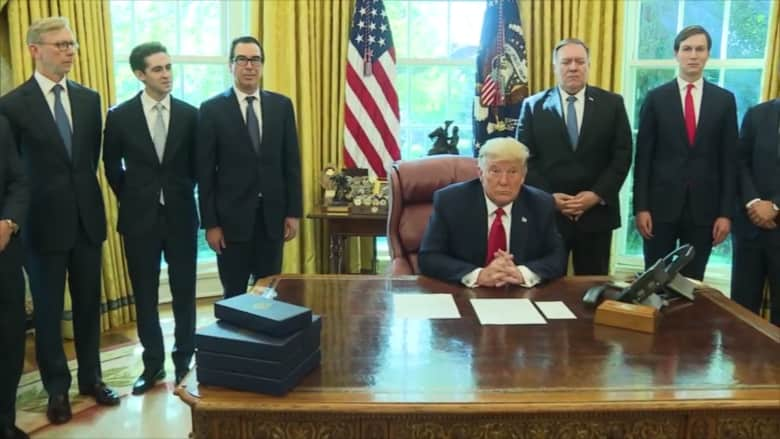
Locate an element on the screen. desk top is located at coordinates (483, 373).